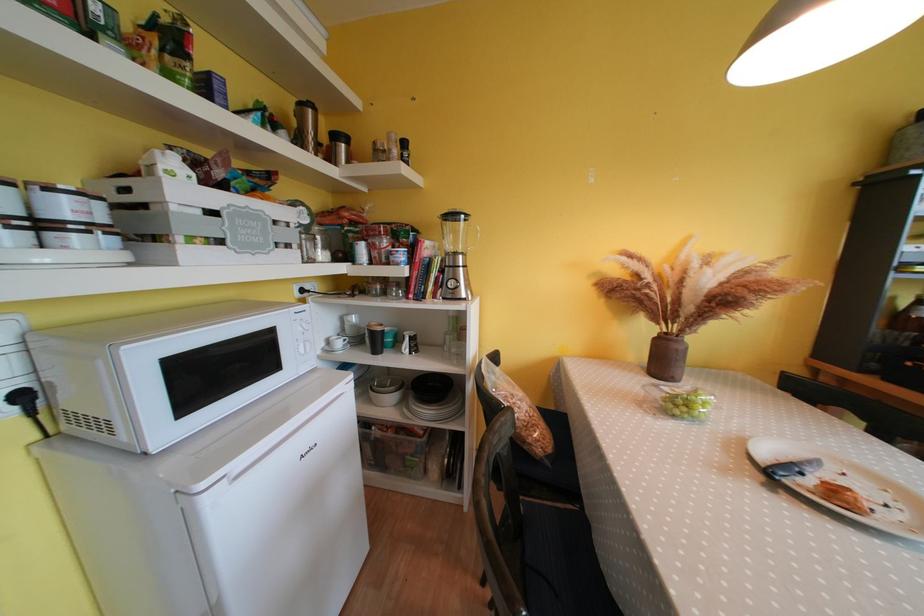
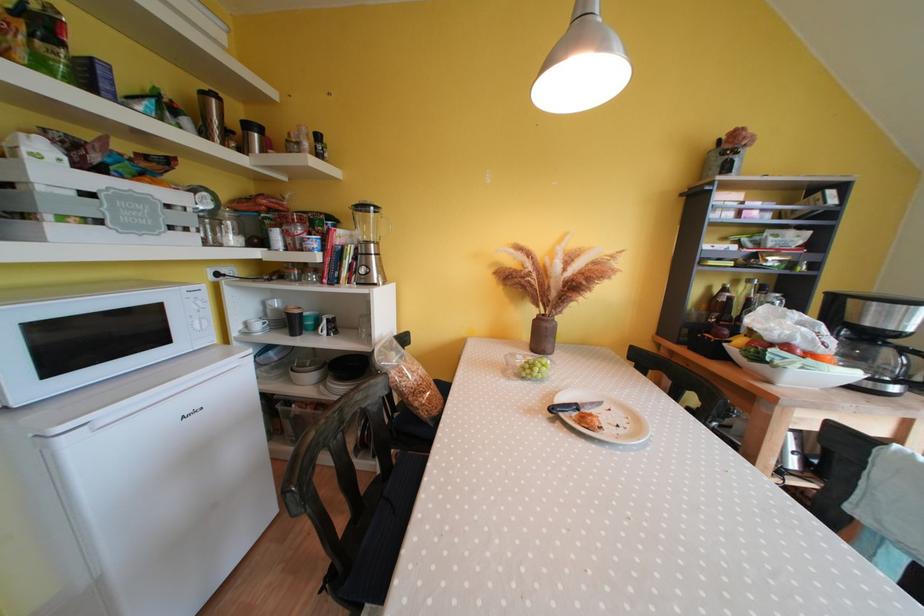
Where in the second image is the point corresponding to (x=467, y=260) from the first image?

(379, 249)